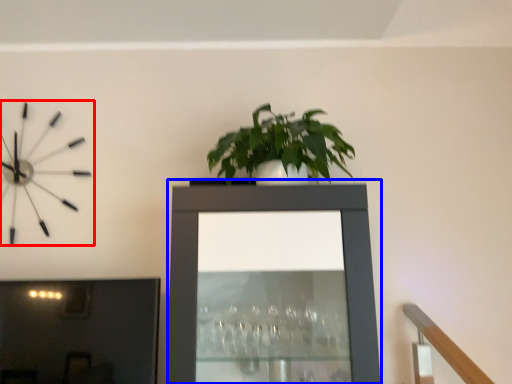
Question: Which object is closer to the camera taking this photo, wall clock (highlighted by a red box) or tv cabinet (highlighted by a blue box)?

Choices:
 (A) wall clock
 (B) tv cabinet

Answer: (B)